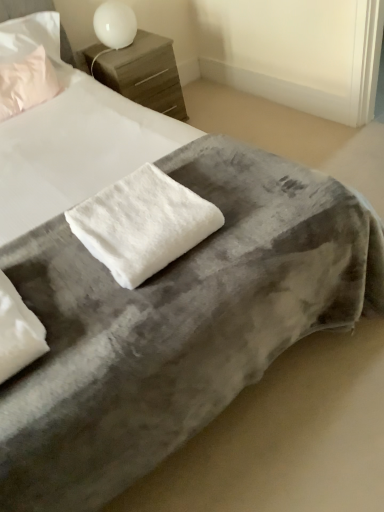
Question: Does wooden nightstand at upper center touch white fluffy towel at center?

Choices:
 (A) no
 (B) yes

Answer: (A)

Question: Considering the relative sizes of wooden nightstand at upper center and white fluffy towel at center in the image provided, is wooden nightstand at upper center thinner than white fluffy towel at center?

Choices:
 (A) yes
 (B) no

Answer: (B)

Question: Is wooden nightstand at upper center in front of white fluffy towel at center?

Choices:
 (A) no
 (B) yes

Answer: (A)

Question: Considering the relative positions of wooden nightstand at upper center and white fluffy towel at center in the image provided, is wooden nightstand at upper center behind white fluffy towel at center?

Choices:
 (A) yes
 (B) no

Answer: (A)

Question: Is wooden nightstand at upper center not within white fluffy towel at center?

Choices:
 (A) yes
 (B) no

Answer: (A)

Question: In terms of size, does white glossy table lamp at upper center appear bigger or smaller than wooden nightstand at upper center?

Choices:
 (A) big
 (B) small

Answer: (B)

Question: From the image's perspective, is white glossy table lamp at upper center above or below wooden nightstand at upper center?

Choices:
 (A) above
 (B) below

Answer: (A)

Question: Is white glossy table lamp at upper center taller or shorter than wooden nightstand at upper center?

Choices:
 (A) tall
 (B) short

Answer: (B)

Question: From a real-world perspective, relative to wooden nightstand at upper center, is white glossy table lamp at upper center vertically above or below?

Choices:
 (A) below
 (B) above

Answer: (B)

Question: Considering the positions of point (117, 8) and point (147, 203), is point (117, 8) closer or farther from the camera than point (147, 203)?

Choices:
 (A) farther
 (B) closer

Answer: (A)

Question: In the image, is white glossy table lamp at upper center on the left side or the right side of white fluffy towel at center?

Choices:
 (A) right
 (B) left

Answer: (B)

Question: From the image's perspective, is white glossy table lamp at upper center above or below white fluffy towel at center?

Choices:
 (A) below
 (B) above

Answer: (B)

Question: Which is correct: white glossy table lamp at upper center is inside white fluffy towel at center, or outside of it?

Choices:
 (A) outside
 (B) inside

Answer: (A)

Question: From a real-world perspective, is matte pink pillow at upper left, which is the 1th pillow in top-to-bottom order, above or below wooden nightstand at upper center?

Choices:
 (A) below
 (B) above

Answer: (B)

Question: Looking at the image, does matte pink pillow at upper left, the 2th pillow from the front, seem bigger or smaller compared to wooden nightstand at upper center?

Choices:
 (A) big
 (B) small

Answer: (B)